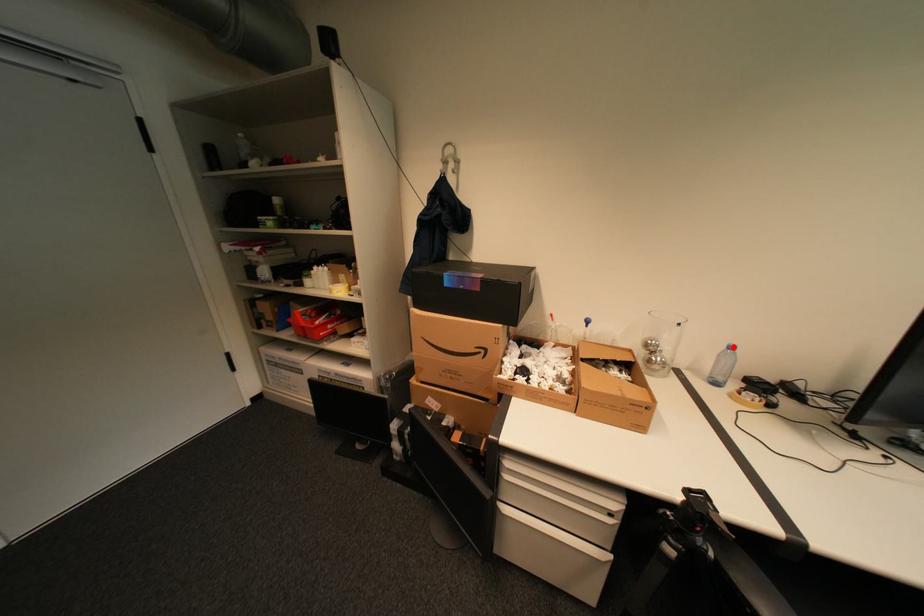
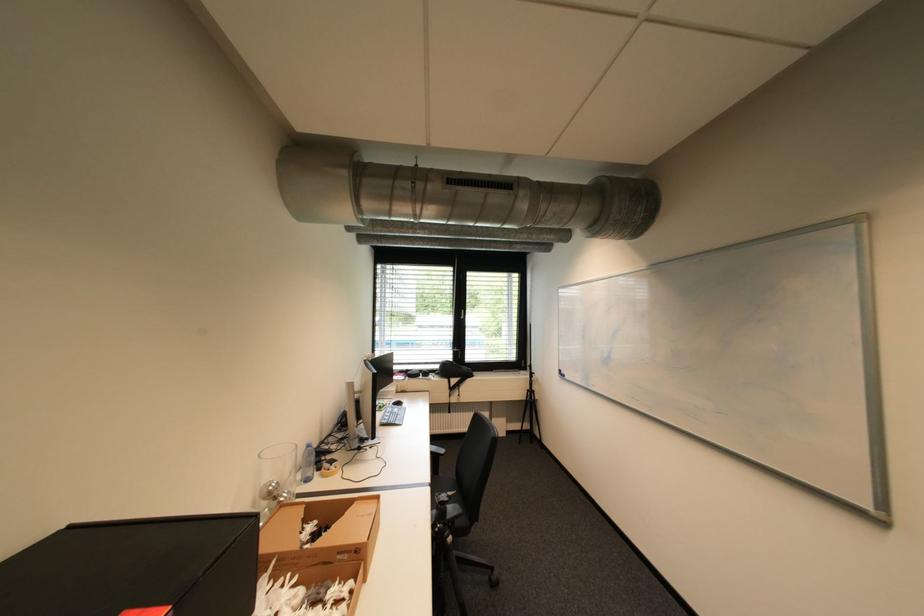
Question: I am providing you with two images of the same scene from different viewpoints. A red point is shown in image1. For the corresponding object point in image2, is it positioned nearer or farther from the camera?

Choices:
 (A) Nearer
 (B) Farther

Answer: (A)